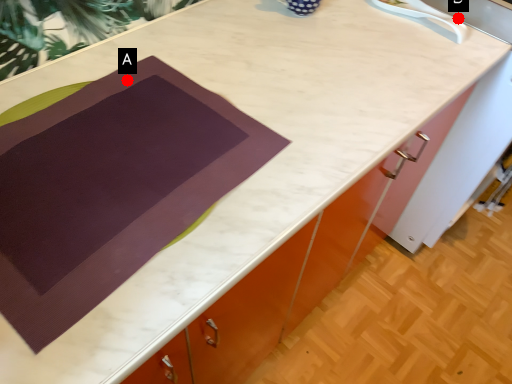
Question: Two points are circled on the image, labeled by A and B beside each circle. Which of the following is the closest to the observer?

Choices:
 (A) A is closer
 (B) B is closer

Answer: (A)